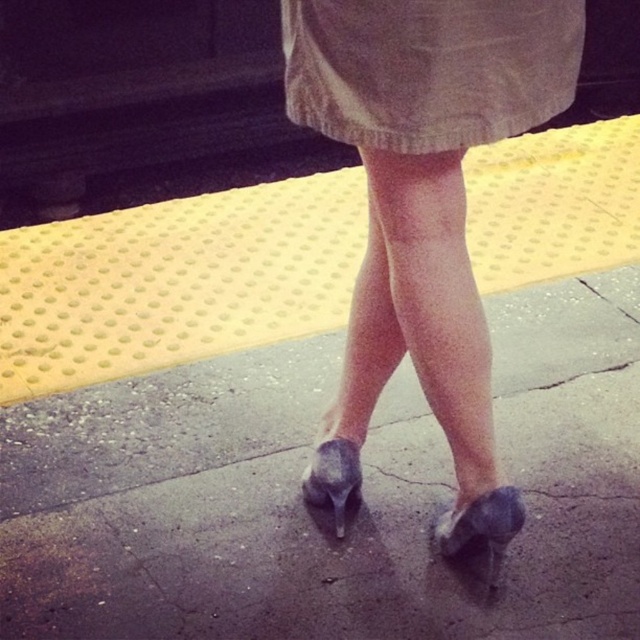
Does gray concrete sidewalk at center come in front of suede high heels at center?

That is False.

Can you confirm if gray concrete sidewalk at center is thinner than suede high heels at center?

Incorrect, gray concrete sidewalk at center's width is not less than suede high heels at center's.

What do you see at coordinates (323, 516) in the screenshot? I see `gray concrete sidewalk at center` at bounding box center [323, 516].

I want to click on gray concrete sidewalk at center, so click(323, 516).

Measure the distance between point (x=410, y=314) and camera.

Point (x=410, y=314) and camera are 1.71 meters apart.

Between suede high heels at center and suede-like gray shoe at lower center, which one is positioned lower?

suede-like gray shoe at lower center is below.

Which is in front, point (481, 120) or point (492, 577)?

Point (481, 120) is in front.

Image resolution: width=640 pixels, height=640 pixels. Identify the location of suede high heels at center. (428, 198).

Who is higher up, gray concrete sidewalk at center or suede-like gray shoe at lower center?

gray concrete sidewalk at center

How far apart are gray concrete sidewalk at center and suede-like gray shoe at lower center?

gray concrete sidewalk at center is 16.29 inches away from suede-like gray shoe at lower center.

Identify the location of gray concrete sidewalk at center. Image resolution: width=640 pixels, height=640 pixels. (323, 516).